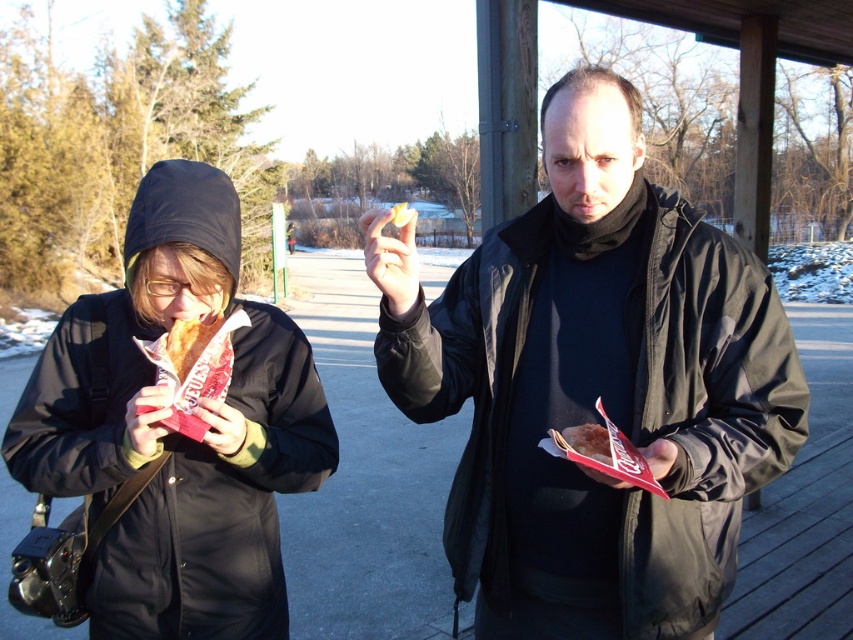
Question: Where is matte black jacket at center located in relation to matte black jacket at left in the image?

Choices:
 (A) above
 (B) below

Answer: (A)

Question: Which of the following is the farthest from the observer?

Choices:
 (A) matte brown bagel at center
 (B) matte black jacket at center

Answer: (A)

Question: Estimate the real-world distances between objects in this image. Which object is closer to the matte brown bagel at center?

Choices:
 (A) matte black jacket at left
 (B) matte black jacket at center

Answer: (B)

Question: Does matte black jacket at left appear over matte brown bagel at center?

Choices:
 (A) no
 (B) yes

Answer: (B)

Question: Which point is closer to the camera?

Choices:
 (A) (556, 596)
 (B) (596, 452)
 (C) (318, 474)

Answer: (B)

Question: Is matte black jacket at center positioned behind matte black jacket at left?

Choices:
 (A) yes
 (B) no

Answer: (B)